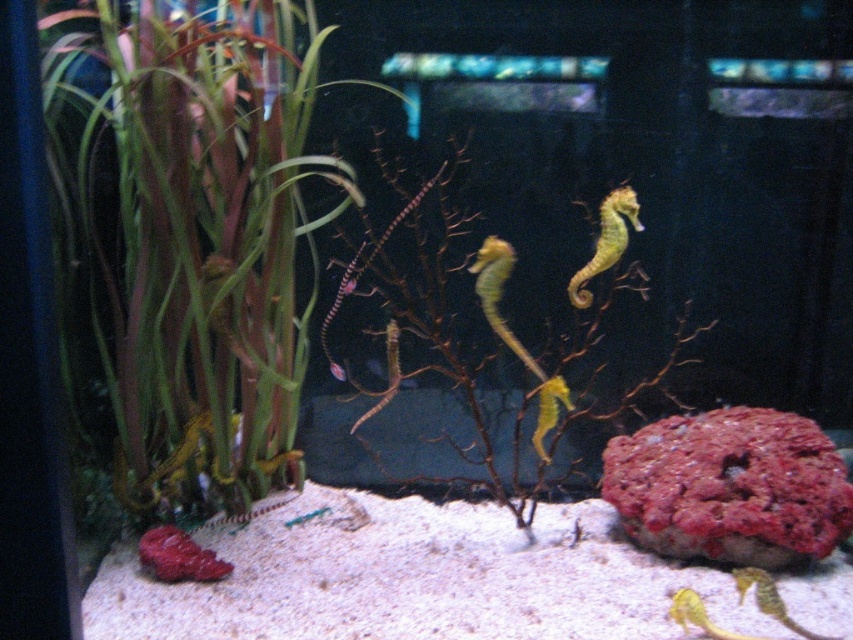
Question: Which object is positioned farthest from the green matte seahorse at center?

Choices:
 (A) smooth yellow seahorse at center
 (B) green matte plant at left
 (C) yellow matte seahorse at center

Answer: (A)

Question: Observing the image, what is the correct spatial positioning of smooth yellow seahorse at center in reference to green matte seahorse at center?

Choices:
 (A) right
 (B) left

Answer: (A)

Question: Which point is closer to the camera?

Choices:
 (A) yellow matte seahorse at center
 (B) green matte seahorse at center

Answer: (A)

Question: Does green matte plant at left appear under smooth yellow seahorse at center?

Choices:
 (A) yes
 (B) no

Answer: (A)

Question: In this image, where is green matte plant at left located relative to green matte seahorse at center?

Choices:
 (A) above
 (B) below

Answer: (A)

Question: Which point is closer to the camera taking this photo?

Choices:
 (A) (300, 129)
 (B) (581, 288)
 (C) (340, 378)

Answer: (A)